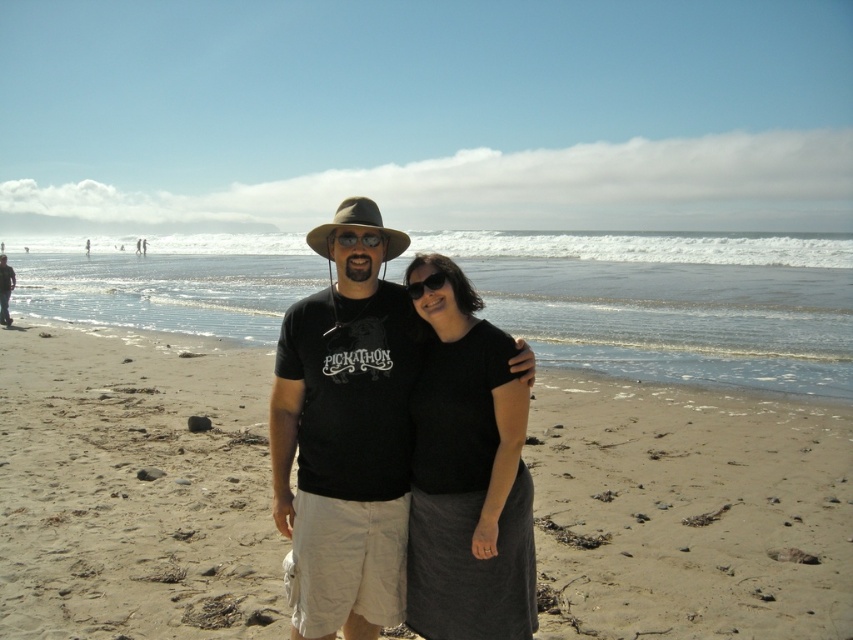
Does black matte skirt at center have a smaller size compared to brown fabric hat at center?

Yes, black matte skirt at center is smaller than brown fabric hat at center.

Is black matte skirt at center taller than brown fabric hat at center?

Yes.

Between point (515, 460) and point (390, 230), which one is positioned behind?

Positioned behind is point (390, 230).

Where is `black matte skirt at center`? The height and width of the screenshot is (640, 853). black matte skirt at center is located at coordinates (468, 476).

Does sandy beach at center have a larger size compared to black cotton t-shirt at center?

Answer: Yes, sandy beach at center is bigger than black cotton t-shirt at center.

Does point (177, 467) lie in front of point (364, 378)?

No.

This screenshot has width=853, height=640. I want to click on sandy beach at center, so click(134, 490).

Between sandy beach at center and black matte sunglasses at center, which one has more height?

sandy beach at center is taller.

In order to click on sandy beach at center in this screenshot , I will do `click(134, 490)`.

The height and width of the screenshot is (640, 853). Describe the element at coordinates (134, 490) in the screenshot. I see `sandy beach at center` at that location.

Locate an element on the screen. sandy beach at center is located at coordinates (134, 490).